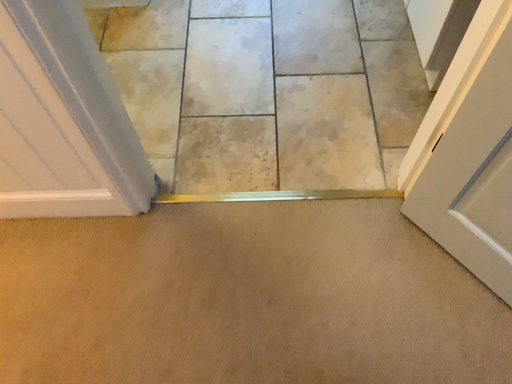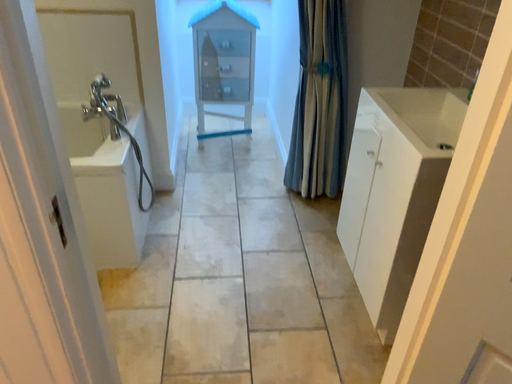
Question: How did the camera likely rotate when shooting the video?

Choices:
 (A) rotated upward
 (B) rotated downward

Answer: (A)